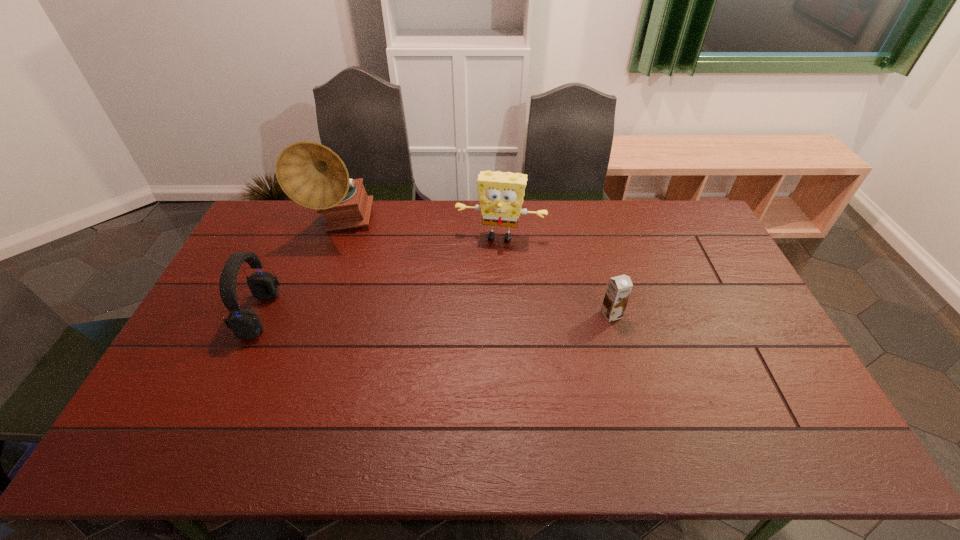
Locate an element on the screen. Image resolution: width=960 pixels, height=540 pixels. headset is located at coordinates (245, 324).

Where is `the shortest object`? the shortest object is located at coordinates (619, 288).

You are a GUI agent. You are given a task and a screenshot of the screen. Output one action in this format:
    pyautogui.click(x=<x>, y=<y>)
    Task: Click on the rightmost object
    The width and height of the screenshot is (960, 540).
    Given the screenshot: What is the action you would take?
    pyautogui.click(x=619, y=288)

At what (x,y) coordinates should I click in order to perform the action: click on phonograph record. Please return your answer as a coordinate pair (x, y). The height and width of the screenshot is (540, 960). Looking at the image, I should click on (311, 174).

Find the location of a particular element. The image size is (960, 540). sponge is located at coordinates (501, 194).

Identify the location of vacant space located on the headband of the headset. The height and width of the screenshot is (540, 960). pos(355,314).

You are a GUI agent. You are given a task and a screenshot of the screen. Output one action in this format:
    pyautogui.click(x=<x>, y=<y>)
    Task: Click on the free space located on the right of the shortest object
    The image size is (960, 540).
    Given the screenshot: What is the action you would take?
    pyautogui.click(x=678, y=314)

Where is `free spot located on the horn of the phonograph record`? free spot located on the horn of the phonograph record is located at coordinates (375, 285).

This screenshot has width=960, height=540. I want to click on vacant space positioned 0.090m on the horn of the phonograph record, so click(x=359, y=260).

What are the coordinates of `vacant space situated on the horn of the phonograph record` in the screenshot? It's located at (396, 320).